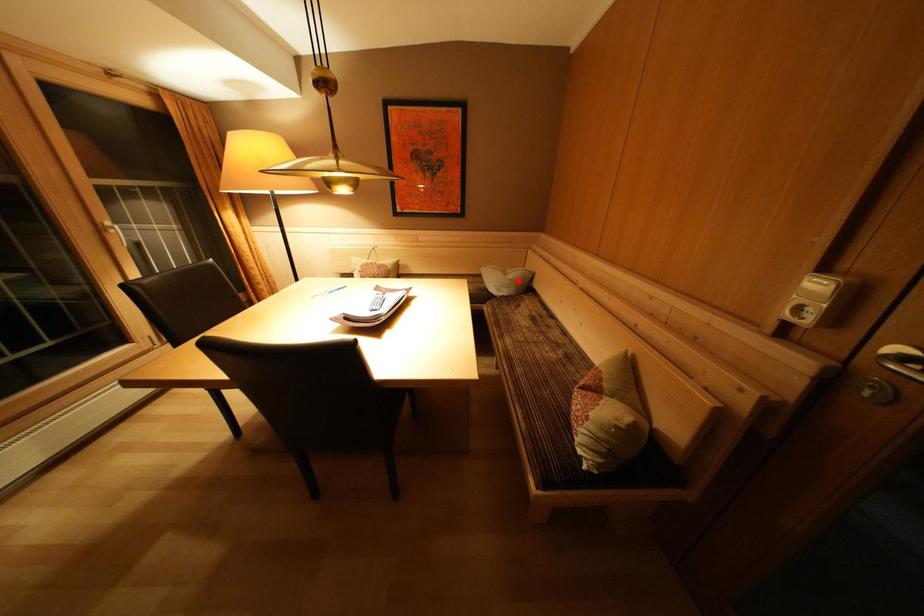
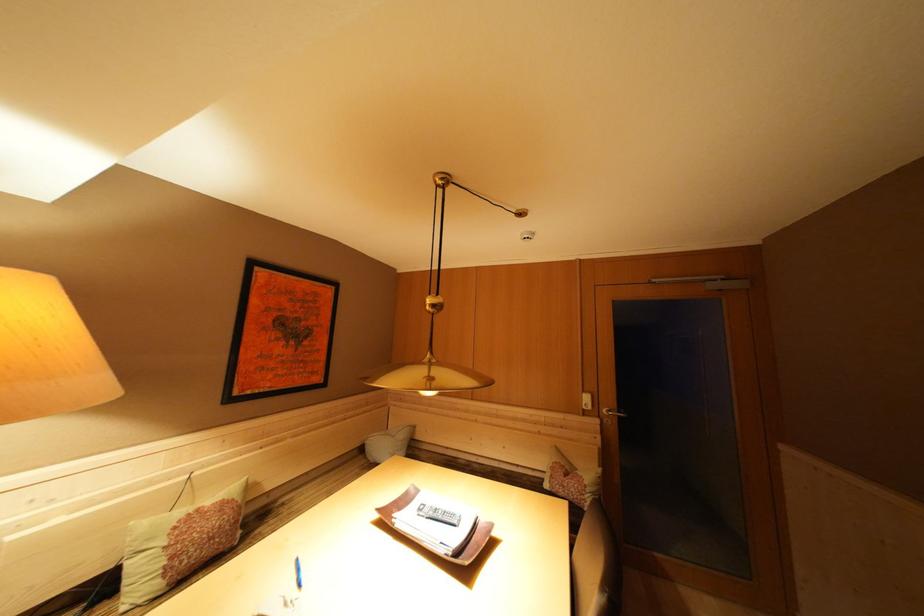
Question: I am providing you with two images of the same scene from different viewpoints. In image1, a red point is highlighted. Considering the same 3D point in image2, which of the following is correct?

Choices:
 (A) It is closer
 (B) It is farther

Answer: (B)